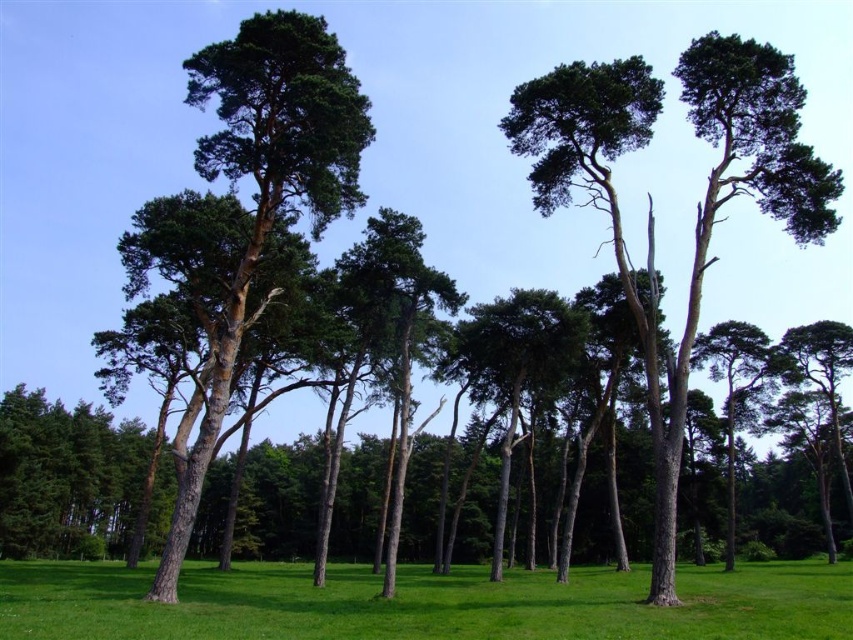
Is green grass at center smaller than green matte tree at center?

No.

This screenshot has height=640, width=853. What do you see at coordinates (422, 604) in the screenshot? I see `green grass at center` at bounding box center [422, 604].

Find the location of a particular element. green grass at center is located at coordinates (422, 604).